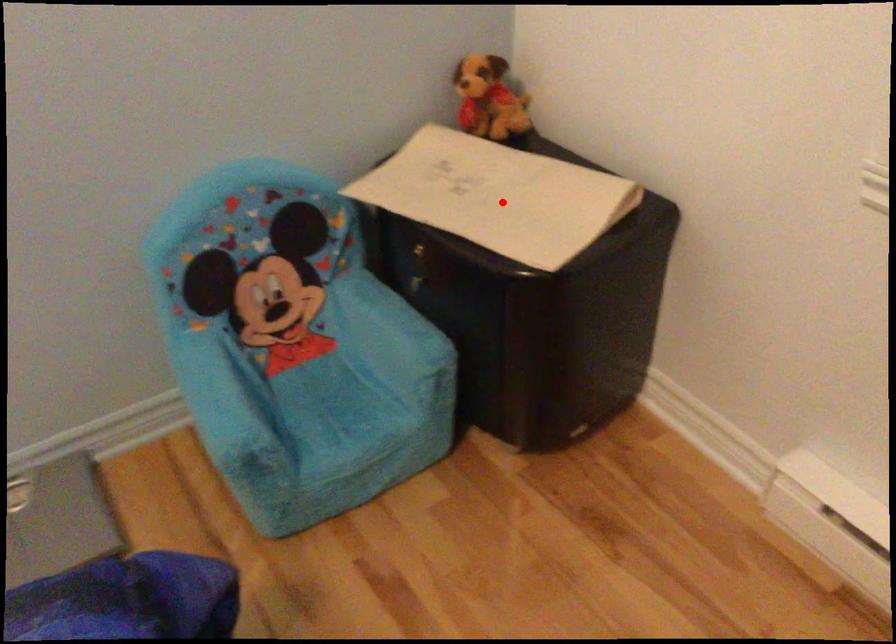
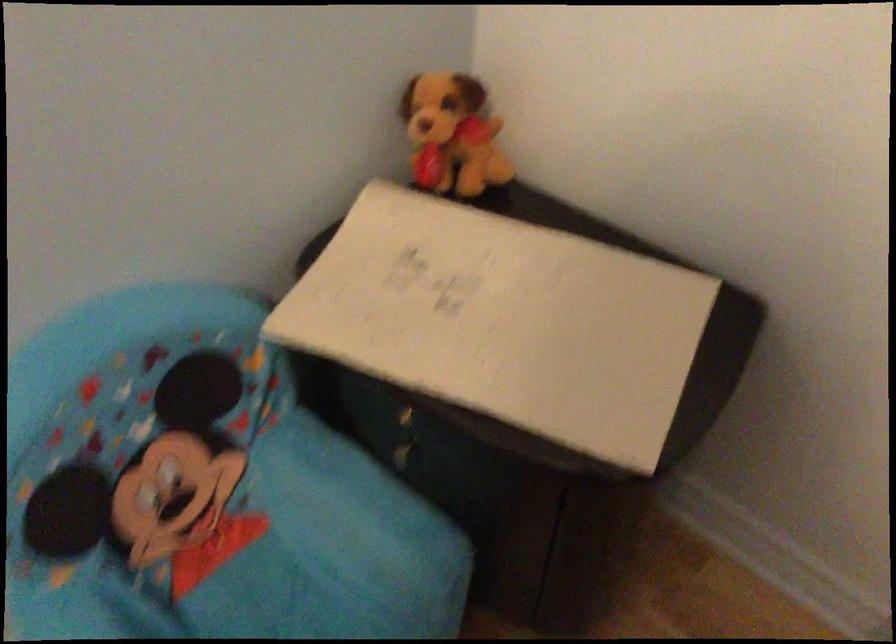
Question: I am providing you with two images of the same scene from different viewpoints. A red point is shown in image1. For the corresponding object point in image2, is it positioned nearer or farther from the camera?

Choices:
 (A) Nearer
 (B) Farther

Answer: (A)